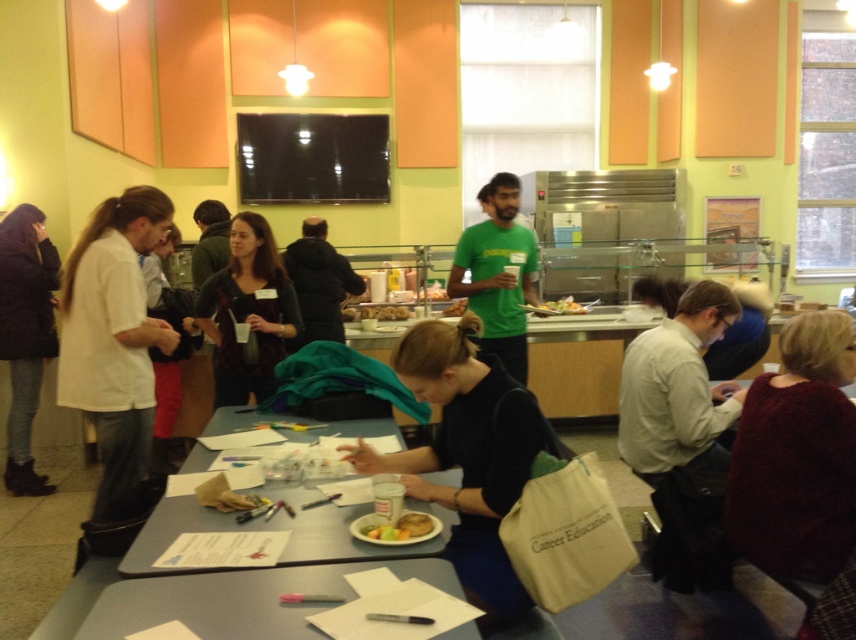
In the scene shown: You are a server in the cafeteria and need to place a new white paper plate at center on the gray plastic table at lower center. Can you reach the table from your current position without moving your feet?

The gray plastic table at lower center is closer to the viewer than the white paper plate at center, so yes, you can reach the table without moving your feet since it is nearer to you.

You are a customer in the cafeteria and you see two shirts displayed on mannequins near the entrance. The white matte shirt at left and the green matte shirt at center. Which shirt is taller?

The white matte shirt at left is much taller than the green matte shirt at center.